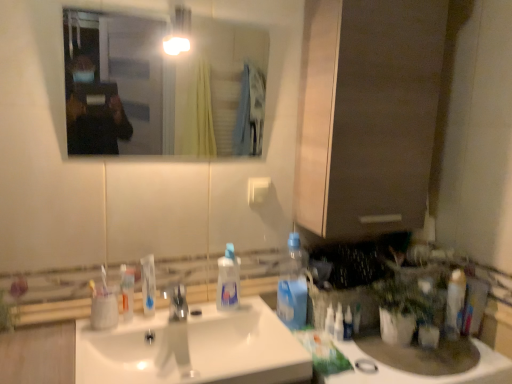
The height and width of the screenshot is (384, 512). I want to click on vacant region to the left of white glossy toothpaste tube at right, placed as the first toiletry when sorted from right to left, so click(401, 351).